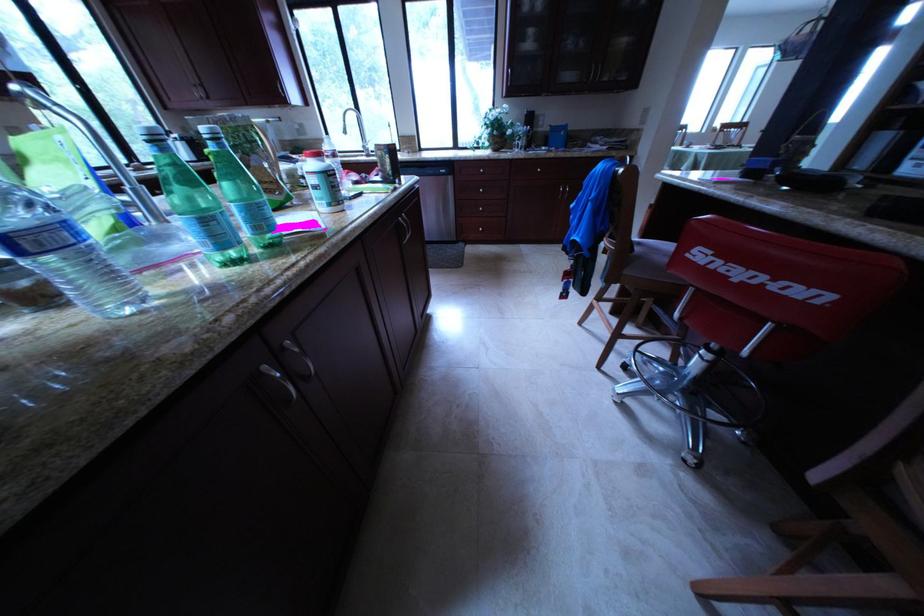
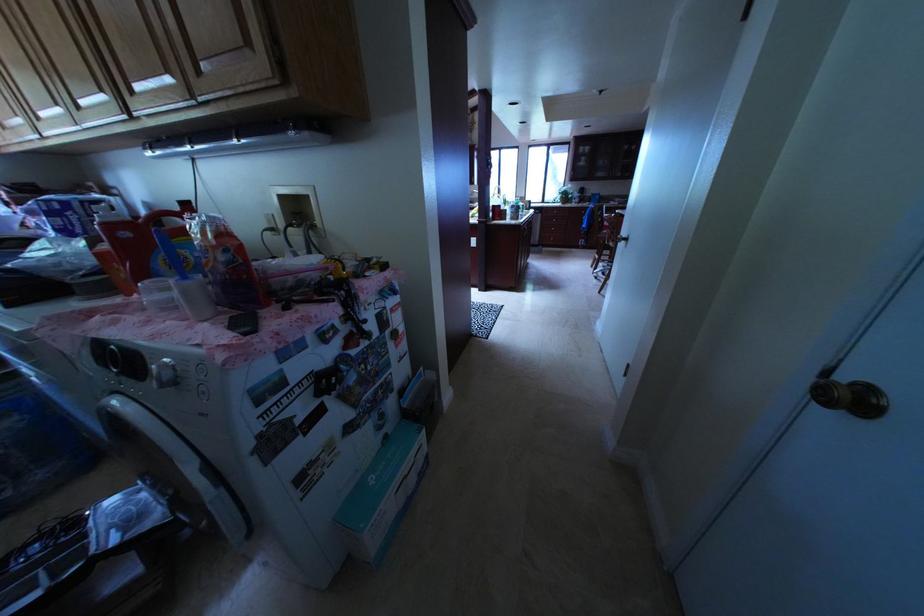
Question: In a continuous first-person perspective shot, in which direction is the camera moving?

Choices:
 (A) Left
 (B) Right
 (C) Forward
 (D) Backward

Answer: (D)